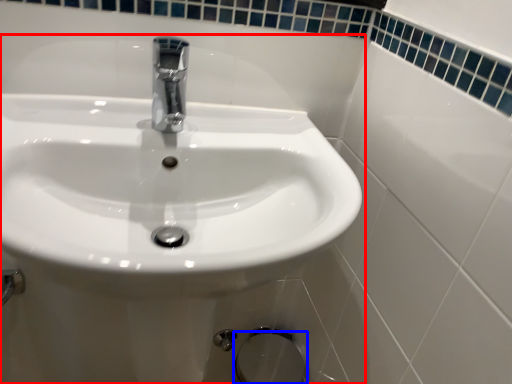
Question: Which object is closer to the camera taking this photo, sink (highlighted by a red box) or bidet (highlighted by a blue box)?

Choices:
 (A) sink
 (B) bidet

Answer: (A)